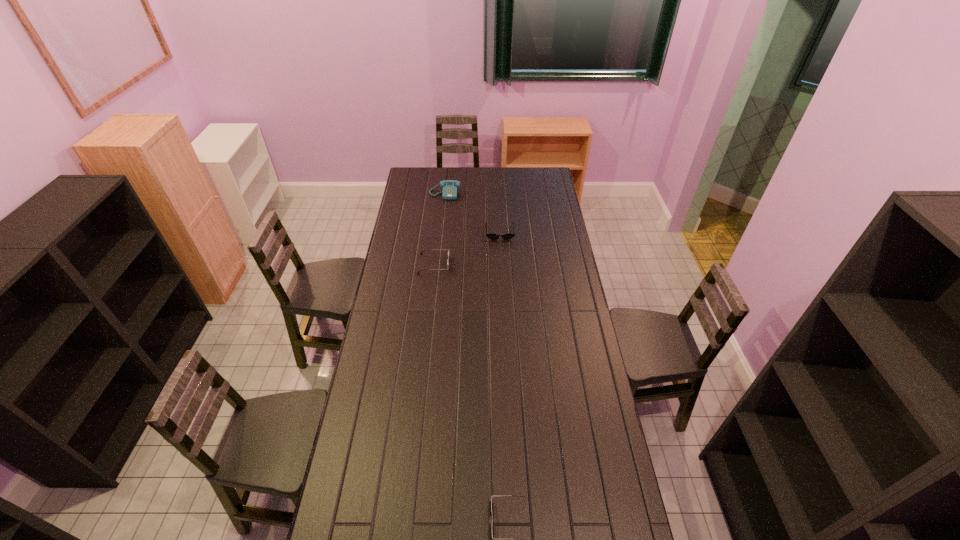
I want to click on sunglasses at the left edge, so click(425, 249).

I want to click on vacant point at the left edge, so click(x=384, y=317).

Find the location of a particular element. The width and height of the screenshot is (960, 540). blank space at the right edge of the desktop is located at coordinates 540,207.

Identify the location of vacant space at the far left corner. Image resolution: width=960 pixels, height=540 pixels. (408, 174).

This screenshot has height=540, width=960. Find the location of `vacant space in between the farthest object and the second nearest object`. vacant space in between the farthest object and the second nearest object is located at coordinates (440, 229).

Where is `empty space that is in between the second tallest sunglasses and the telephone`? empty space that is in between the second tallest sunglasses and the telephone is located at coordinates (472, 213).

Where is `vacant space that is in between the second shortest sunglasses and the second nearest object`? vacant space that is in between the second shortest sunglasses and the second nearest object is located at coordinates (467, 248).

I want to click on free space between the farthest sunglasses and the telephone, so click(x=472, y=213).

This screenshot has width=960, height=540. In order to click on free space between the farthest object and the third tallest object in this screenshot , I will do `click(472, 213)`.

Where is `empty space between the third nearest object and the tallest sunglasses`? empty space between the third nearest object and the tallest sunglasses is located at coordinates (467, 248).